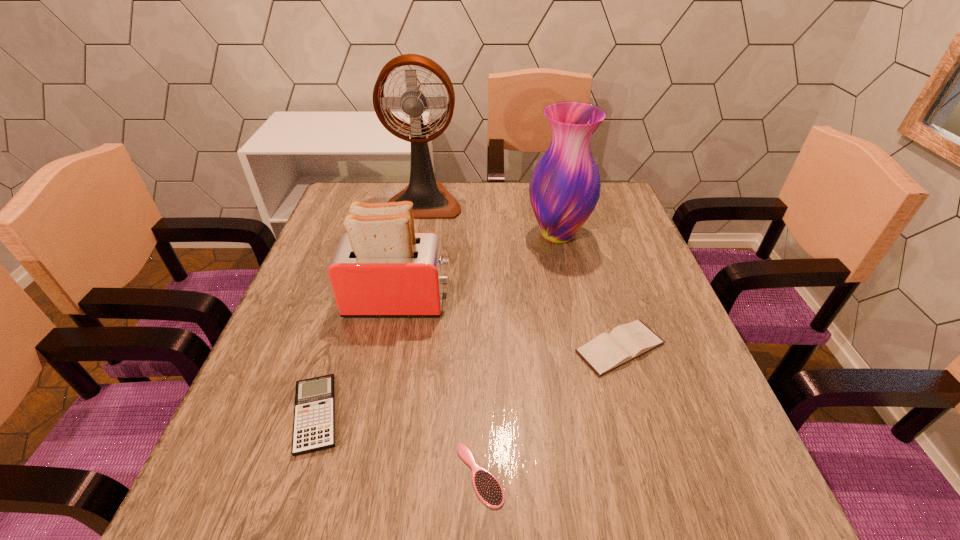
I want to click on fan, so click(x=430, y=199).

Find the location of a particular element. vase is located at coordinates (564, 189).

At what (x,y) coordinates should I click in order to perform the action: click on the fourth nearest object. Please return your answer as a coordinate pair (x, y). The image size is (960, 540). Looking at the image, I should click on (381, 267).

This screenshot has height=540, width=960. I want to click on the fourth shortest object, so click(x=381, y=267).

Locate an element on the screen. the third nearest object is located at coordinates (624, 343).

At what (x,y) coordinates should I click in order to perform the action: click on the fourth tallest object. Please return your answer as a coordinate pair (x, y). Looking at the image, I should click on (624, 343).

Locate an element on the screen. calculator is located at coordinates (314, 412).

Identify the location of the third object from right to left. Image resolution: width=960 pixels, height=540 pixels. (487, 487).

The width and height of the screenshot is (960, 540). I want to click on vacant position located on the front-facing side of the fan, so click(411, 268).

Where is `vacant space positioned 0.270m on the front of the vase`? vacant space positioned 0.270m on the front of the vase is located at coordinates (581, 333).